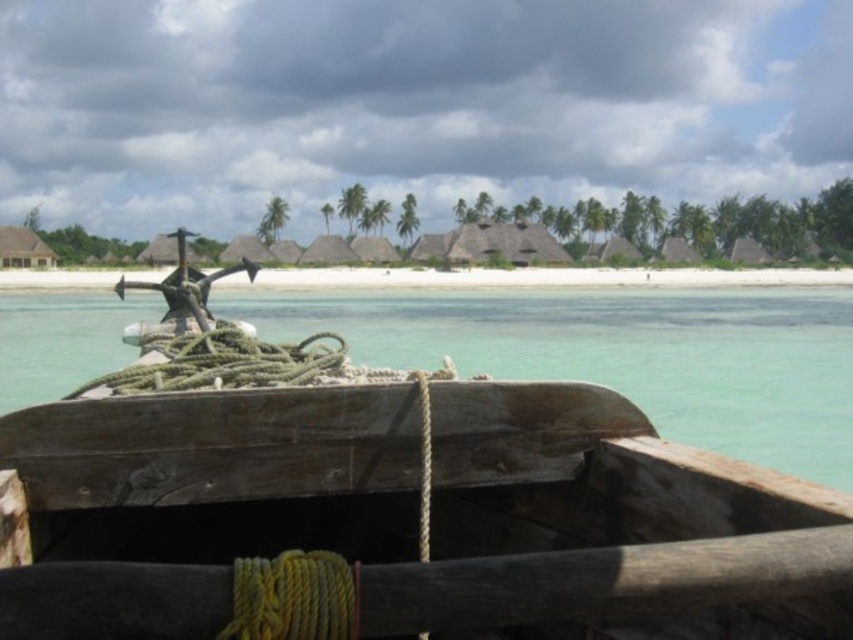
Can you confirm if wooden boat at center is shorter than white sand beach at center?

Indeed, wooden boat at center has a lesser height compared to white sand beach at center.

Does wooden boat at center have a greater width compared to white sand beach at center?

In fact, wooden boat at center might be narrower than white sand beach at center.

You are a GUI agent. You are given a task and a screenshot of the screen. Output one action in this format:
    pyautogui.click(x=<x>, y=<y>)
    Task: Click on the wooden boat at center
    The height and width of the screenshot is (640, 853).
    Given the screenshot: What is the action you would take?
    pyautogui.click(x=386, y=502)